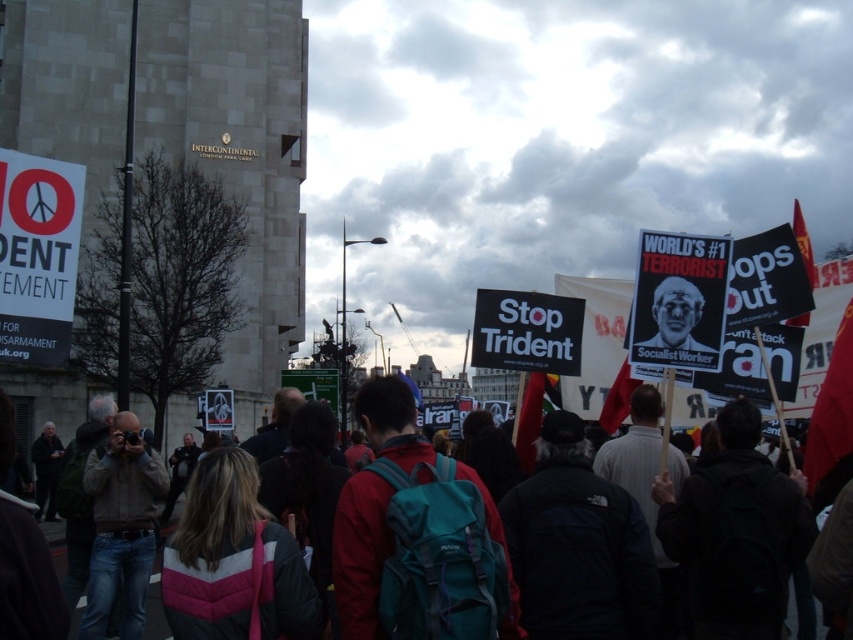
Looking at this image, you are a photographer trying to capture a wide shot of the protest scene. You are standing at the edge of the crowd and see the teal fabric backpack at center and the matte black poster at center. Can you fit both objects in your camera frame if your camera has a maximum field of view of 100 feet?

The distance between the teal fabric backpack at center and the matte black poster at center is 103.84 feet, which exceeds the camera field of view of 100 feet. Therefore, you cannot fit both objects in the frame at the same time.

You are a photographer trying to capture a clear shot of the matte black poster at center and the teal fabric backpack at center. Since both are at the center, which one is positioned to the left?

The teal fabric backpack at center is to the left of the matte black poster at center, so it is positioned to the left.

You are a photographer trying to capture the protest scene. You notice a teal fabric backpack at center and a matte black poster at center. Which object should you focus on to ensure it appears larger in your photo?

The teal fabric backpack at center is much taller than the matte black poster at center, so focusing on the teal fabric backpack at center will make it appear larger in the photo.